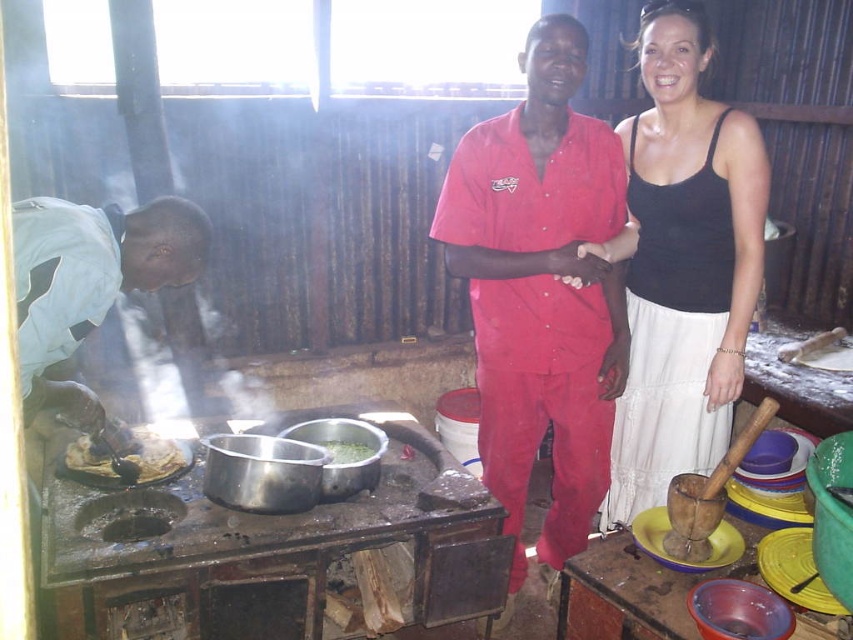
Is brown matte food at lower left shorter than green matte pot at center?

Incorrect, brown matte food at lower left's height does not fall short of green matte pot at center's.

Which is behind, point (74, 456) or point (343, 448)?

Positioned behind is point (343, 448).

Is point (85, 449) less distant than point (325, 442)?

Yes.

The image size is (853, 640). Find the location of `brown matte food at lower left`. brown matte food at lower left is located at coordinates (125, 460).

Can you confirm if black cotton tank top at center is taller than green matte pot at center?

Yes, black cotton tank top at center is taller than green matte pot at center.

Is black cotton tank top at center in front of green matte pot at center?

Yes.

Does point (688, 170) come in front of point (340, 460)?

Yes, it is.

Where is `black cotton tank top at center`? black cotton tank top at center is located at coordinates (682, 262).

Consider the image. Which is below, matte red shirt at center or brown matte food at lower left?

Positioned lower is brown matte food at lower left.

Who is positioned more to the left, matte red shirt at center or brown matte food at lower left?

brown matte food at lower left is more to the left.

Identify the location of matte red shirt at center. (682, 262).